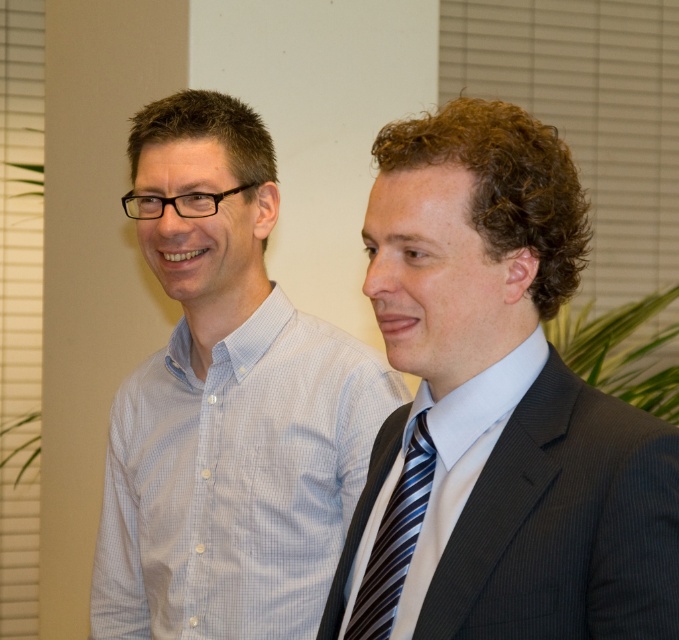
Question: Which point is farther to the camera?

Choices:
 (A) dark gray suit at right
 (B) white checkered shirt at left

Answer: (B)

Question: In this image, where is light blue woven shirt at right located relative to striped silk tie at right?

Choices:
 (A) right
 (B) left

Answer: (A)

Question: Which object is the closest to the white checkered shirt at left?

Choices:
 (A) dark gray suit at right
 (B) striped silk tie at right

Answer: (A)

Question: Among these points, which one is farthest from the camera?

Choices:
 (A) (274, 577)
 (B) (414, 435)

Answer: (A)

Question: Does white checkered shirt at left have a greater width compared to light blue woven shirt at right?

Choices:
 (A) yes
 (B) no

Answer: (A)

Question: Is white checkered shirt at left positioned at the back of light blue woven shirt at right?

Choices:
 (A) no
 (B) yes

Answer: (B)